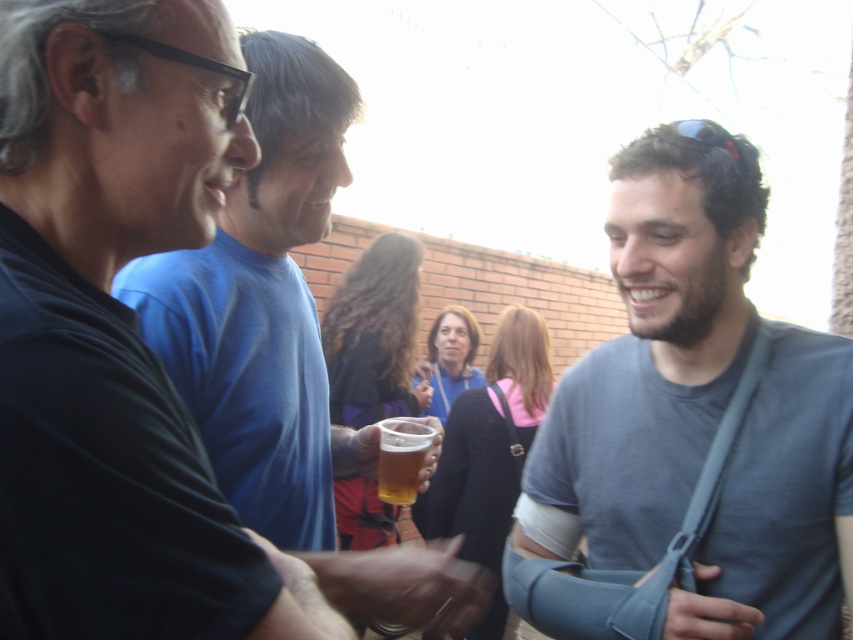
You are a photographer at this event and want to take a closeup shot of the gray fabric arm sling at center and the translucent glass beer at center. Which object should you focus on first to ensure both are in focus?

The gray fabric arm sling at center is closer to the viewer than the translucent glass beer at center, so focus on the gray fabric arm sling at center first to ensure both are in focus.

You are a photographer at the gathering and want to take a photo of the gray fabric arm sling at center and the translucent glass beer at center. Which object should you focus on first if you want to capture both in the same frame without moving the camera?

The gray fabric arm sling at center is positioned on the right side of the translucent glass beer at center, so you should focus on the translucent glass beer at center first to ensure both are in the frame.